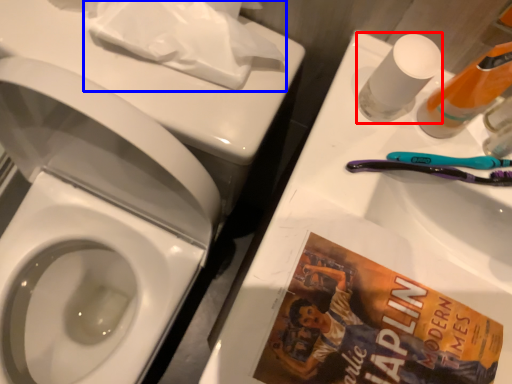
Question: Among these objects, which one is nearest to the camera, mouthwash (highlighted by a red box) or toilet paper (highlighted by a blue box)?

Choices:
 (A) mouthwash
 (B) toilet paper

Answer: (A)